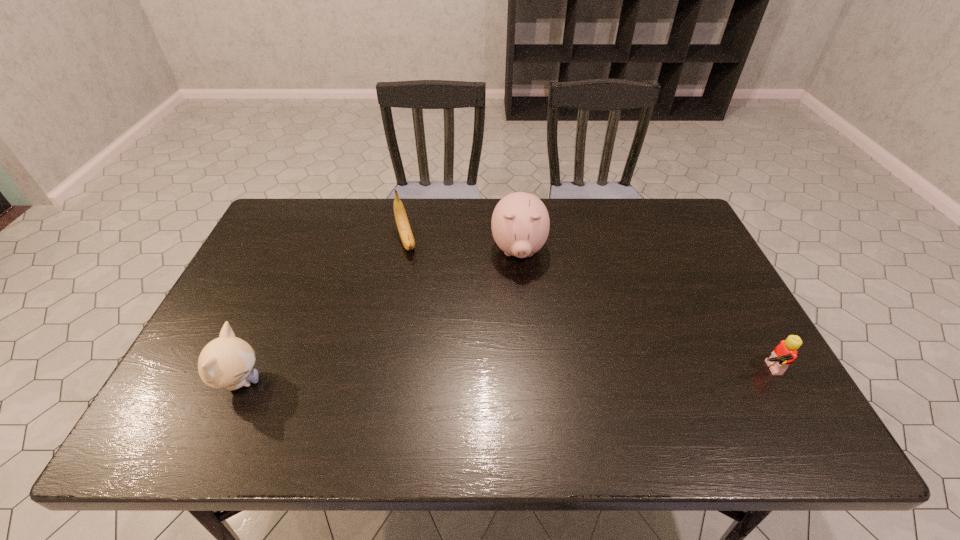
What are the coordinates of `kitten` in the screenshot? It's located at (226, 362).

Locate an element on the screen. The height and width of the screenshot is (540, 960). the rightmost object is located at coordinates 785,353.

This screenshot has height=540, width=960. I want to click on Lego, so click(785, 353).

Where is `piggy bank`? The width and height of the screenshot is (960, 540). piggy bank is located at coordinates (520, 224).

Locate an element on the screen. The image size is (960, 540). banana is located at coordinates (402, 222).

Identify the location of vacant region located 0.160m on the face of the leftmost object. This screenshot has width=960, height=540. (333, 382).

At what (x,y) coordinates should I click in order to perform the action: click on vacant space positioned at the snout of the third object from left to right. Please return your answer as a coordinate pair (x, y). Image resolution: width=960 pixels, height=540 pixels. Looking at the image, I should click on (525, 401).

Image resolution: width=960 pixels, height=540 pixels. I want to click on blank area located at the snout of the third object from left to right, so click(x=522, y=325).

Identify the location of vacant space located 0.070m at the snout of the third object from left to right. (520, 294).

The width and height of the screenshot is (960, 540). Identify the location of vacant area located 0.300m at the start of the peel on the banana. (434, 330).